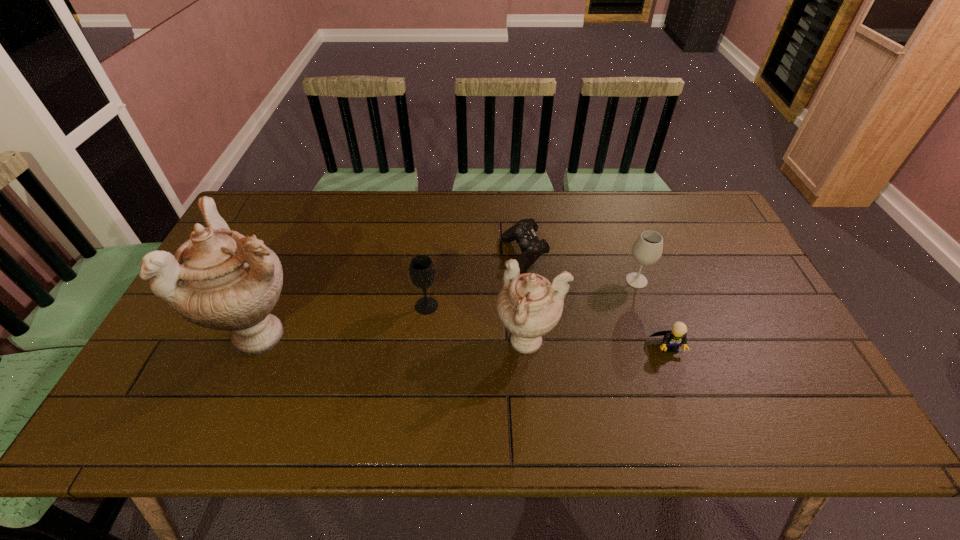
The image size is (960, 540). In the image, there is a desktop. What are the coordinates of `vacant space at the right edge` in the screenshot? It's located at (713, 300).

I want to click on vacant area at the near left corner of the desktop, so (163, 396).

This screenshot has width=960, height=540. Find the location of `free location at the far right corner of the desktop`. free location at the far right corner of the desktop is located at coordinates [x=669, y=206].

This screenshot has height=540, width=960. I want to click on free space between the control and the second shortest object, so click(596, 301).

Identify the location of free spot between the shortest object and the Lego. (596, 301).

The width and height of the screenshot is (960, 540). I want to click on vacant space that's between the right wineglass and the right urn, so click(583, 312).

Locate an element on the screen. vacant space that is in between the leftmost object and the fifth tallest object is located at coordinates (467, 340).

Identify the location of vacant area between the right wineglass and the shorter urn. The image size is (960, 540). (583, 312).

This screenshot has height=540, width=960. Identify the location of empty location between the nearer wineglass and the control. (475, 281).

Identify the location of vacant point located between the control and the farther wineglass. The image size is (960, 540). (581, 268).